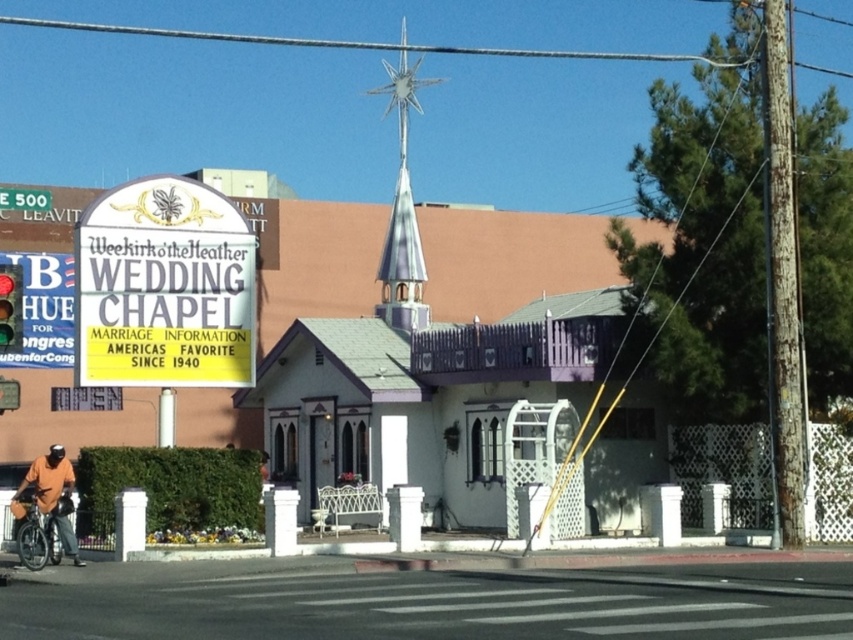
Does shiny silver spire at upper center have a larger size compared to red glass traffic light at upper left?

Correct, shiny silver spire at upper center is larger in size than red glass traffic light at upper left.

Is shiny silver spire at upper center smaller than red glass traffic light at upper left?

No.

Image resolution: width=853 pixels, height=640 pixels. I want to click on shiny silver spire at upper center, so 402,211.

Can you confirm if black asphalt at lower center is smaller than silver metallic bicycle at lower left?

Incorrect, black asphalt at lower center is not smaller in size than silver metallic bicycle at lower left.

Is black asphalt at lower center taller than silver metallic bicycle at lower left?

No.

Does point (650, 570) come behind point (26, 547)?

No, (650, 570) is in front of (26, 547).

Where is `black asphalt at lower center`? black asphalt at lower center is located at coordinates (428, 602).

Does point (184, 380) come closer to viewer compared to point (39, 518)?

That is False.

Does white plastic sign at upper left appear on the right side of silver metallic bicycle at lower left?

Indeed, white plastic sign at upper left is positioned on the right side of silver metallic bicycle at lower left.

Does point (99, 364) come farther from viewer compared to point (44, 538)?

That is True.

The width and height of the screenshot is (853, 640). What are the coordinates of `white plastic sign at upper left` in the screenshot? It's located at (164, 288).